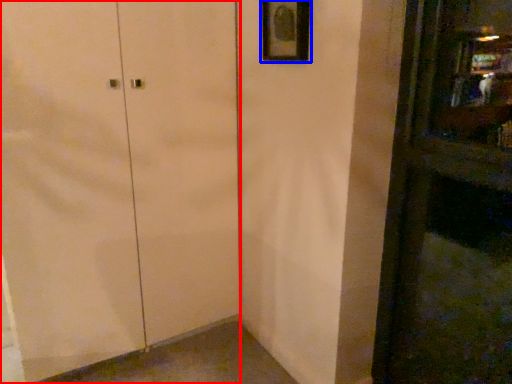
Question: Which of the following is the farthest to the observer, door (highlighted by a red box) or picture frame (highlighted by a blue box)?

Choices:
 (A) door
 (B) picture frame

Answer: (B)